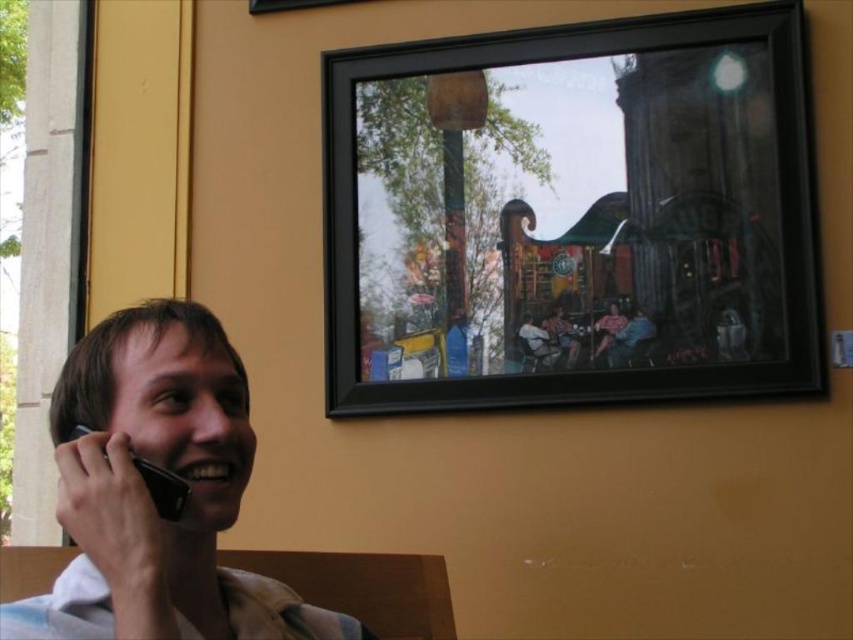
You are a delivery robot with a 24 inch arm. You need to hand a package to the person holding the matte black phone at left. Can your arm reach the person?

The distance between the matte black phone at left and the viewer is 25.13 inches. Since your arm is 24 inches long, it is slightly shorter than the required distance. Therefore, your arm cannot reach the person.

You are an interior designer assessing the placement of the black matte picture frame at upper right and the matte black phone at left. Which object takes up more visual space in the scene?

The black matte picture frame at upper right has a larger size compared to the matte black phone at left, so it takes up more visual space in the scene.

You are an interior designer analyzing the placement of the black matte picture frame at upper right in the room. What are the coordinates of its position?

The black matte picture frame at upper right is located at coordinates [582,221].